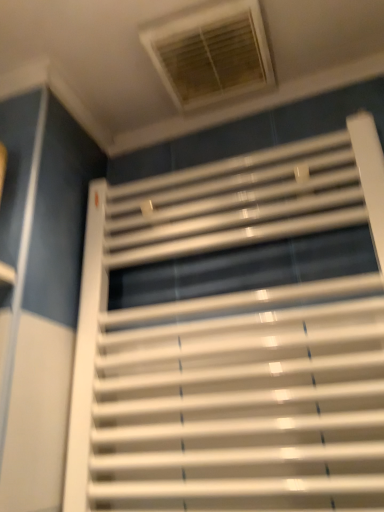
Question: Can we say white plastic window at upper center lies outside white glossy window blind at center?

Choices:
 (A) yes
 (B) no

Answer: (A)

Question: Considering the relative sizes of white plastic window at upper center and white glossy window blind at center in the image provided, is white plastic window at upper center shorter than white glossy window blind at center?

Choices:
 (A) yes
 (B) no

Answer: (A)

Question: From a real-world perspective, is white plastic window at upper center on top of white glossy window blind at center?

Choices:
 (A) no
 (B) yes

Answer: (B)

Question: From a real-world perspective, is white plastic window at upper center located beneath white glossy window blind at center?

Choices:
 (A) yes
 (B) no

Answer: (B)

Question: Is white plastic window at upper center looking in the opposite direction of white glossy window blind at center?

Choices:
 (A) yes
 (B) no

Answer: (B)

Question: Can you confirm if white plastic window at upper center is smaller than white glossy window blind at center?

Choices:
 (A) yes
 (B) no

Answer: (A)

Question: From a real-world perspective, is white glossy window blind at center beneath white plastic window at upper center?

Choices:
 (A) no
 (B) yes

Answer: (B)

Question: Could you tell me if white glossy window blind at center is turned towards white plastic window at upper center?

Choices:
 (A) no
 (B) yes

Answer: (A)

Question: Is white glossy window blind at center at the right side of white plastic window at upper center?

Choices:
 (A) no
 (B) yes

Answer: (B)

Question: Considering the relative sizes of white glossy window blind at center and white plastic window at upper center in the image provided, is white glossy window blind at center taller than white plastic window at upper center?

Choices:
 (A) yes
 (B) no

Answer: (A)

Question: From a real-world perspective, is white glossy window blind at center located higher than white plastic window at upper center?

Choices:
 (A) yes
 (B) no

Answer: (B)

Question: Can we say white glossy window blind at center lies outside white plastic window at upper center?

Choices:
 (A) no
 (B) yes

Answer: (B)

Question: From a real-world perspective, is white plastic window at upper center above or below white glossy window blind at center?

Choices:
 (A) above
 (B) below

Answer: (A)